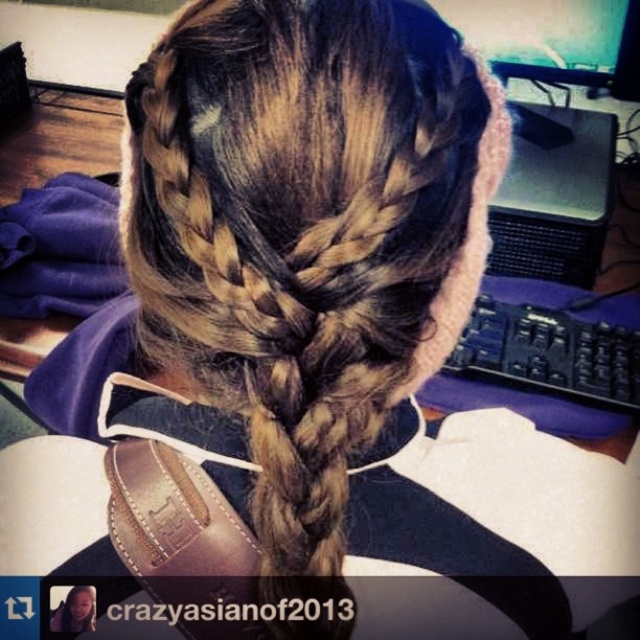
Does black plastic computer at right have a lesser height compared to matte plastic monitor at upper center?

No.

Which is above, black plastic computer at right or matte plastic monitor at upper center?

Positioned higher is matte plastic monitor at upper center.

Image resolution: width=640 pixels, height=640 pixels. Find the location of `black plastic computer at right`. black plastic computer at right is located at coordinates (554, 195).

Where is `black plastic computer at right`? This screenshot has width=640, height=640. black plastic computer at right is located at coordinates (554, 195).